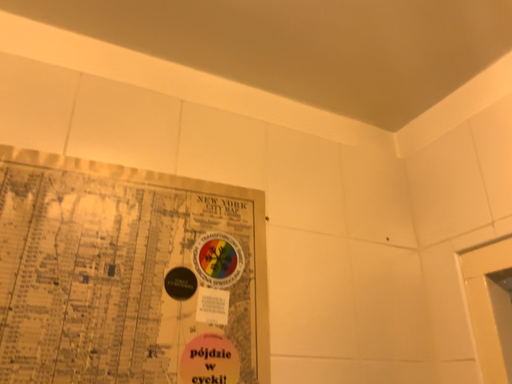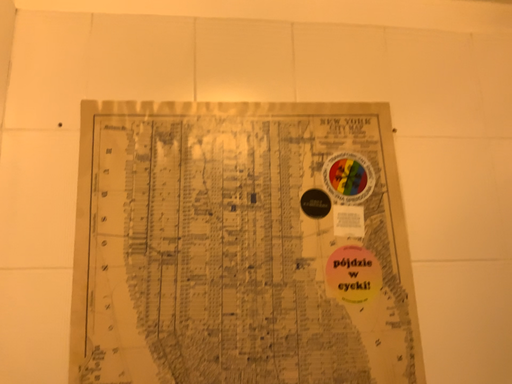
Question: How did the camera likely rotate when shooting the video?

Choices:
 (A) rotated left
 (B) rotated right

Answer: (A)